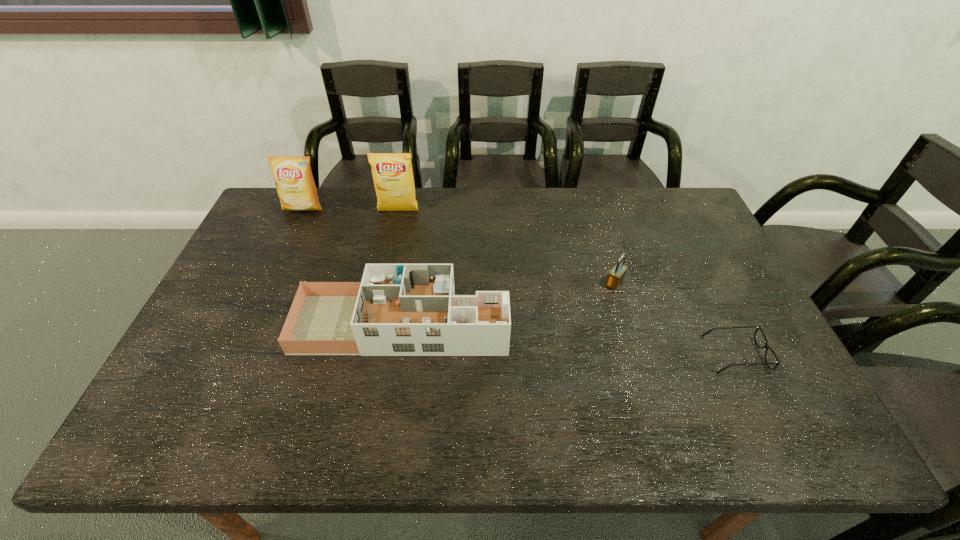
Where is `vacant area that lies between the right crisp (potato chip) and the left crisp (potato chip)`? vacant area that lies between the right crisp (potato chip) and the left crisp (potato chip) is located at coordinates (350, 210).

At what (x,y) coordinates should I click in order to perform the action: click on free spot between the second tallest object and the dollhouse. Please return your answer as a coordinate pair (x, y). Looking at the image, I should click on (352, 266).

Image resolution: width=960 pixels, height=540 pixels. Identify the location of object that ranks as the second closest to the rightmost object. (397, 309).

Choose which object is the third nearest neighbor to the dollhouse. Please provide its 2D coordinates. Your answer should be formatted as a tuple, i.e. [(x, y)], where the tuple contains the x and y coordinates of a point satisfying the conditions above.

[(295, 185)]

This screenshot has width=960, height=540. I want to click on vacant space that satisfies the following two spatial constraints: 1. on the front of the third nearest object with the logo; 2. on the right side of the right crisp (potato chip), so click(383, 283).

Where is `free spot that satisfies the following two spatial constraints: 1. on the front-facing side of the padlock; 2. on the left side of the fourth shortest object`? This screenshot has height=540, width=960. free spot that satisfies the following two spatial constraints: 1. on the front-facing side of the padlock; 2. on the left side of the fourth shortest object is located at coordinates (269, 283).

The height and width of the screenshot is (540, 960). Find the location of `vacant point that satisfies the following two spatial constraints: 1. on the front side of the third farthest object; 2. at the front door of the dollhouse`. vacant point that satisfies the following two spatial constraints: 1. on the front side of the third farthest object; 2. at the front door of the dollhouse is located at coordinates (626, 324).

The image size is (960, 540). I want to click on vacant area that satisfies the following two spatial constraints: 1. on the front-facing side of the leftmost object; 2. on the left side of the third nearest object, so click(269, 283).